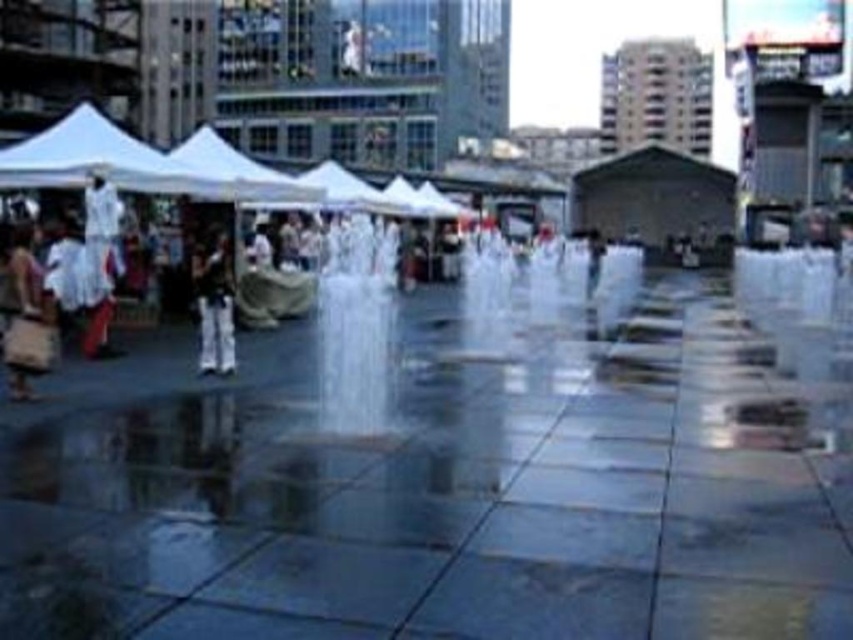
Can you confirm if clear glass fountain at center is taller than dark blue jeans at center?

Correct, clear glass fountain at center is much taller as dark blue jeans at center.

Is clear glass fountain at center wider than dark blue jeans at center?

Yes, clear glass fountain at center is wider than dark blue jeans at center.

Where is `clear glass fountain at center`? This screenshot has width=853, height=640. clear glass fountain at center is located at coordinates (357, 326).

Is brown fabric bag at left shorter than white cotton dress at left?

Yes.

Does point (22, 328) lie in front of point (88, 300)?

Yes, it is.

What are the coordinates of `brown fabric bag at left` in the screenshot? It's located at (27, 316).

Is brown fabric bag at left below white fabric canopy at center?

Yes.

Is the position of brown fabric bag at left less distant than that of white fabric canopy at center?

Yes.

Between point (32, 336) and point (286, 188), which one is positioned behind?

Point (286, 188)

This screenshot has width=853, height=640. I want to click on brown fabric bag at left, so click(x=27, y=316).